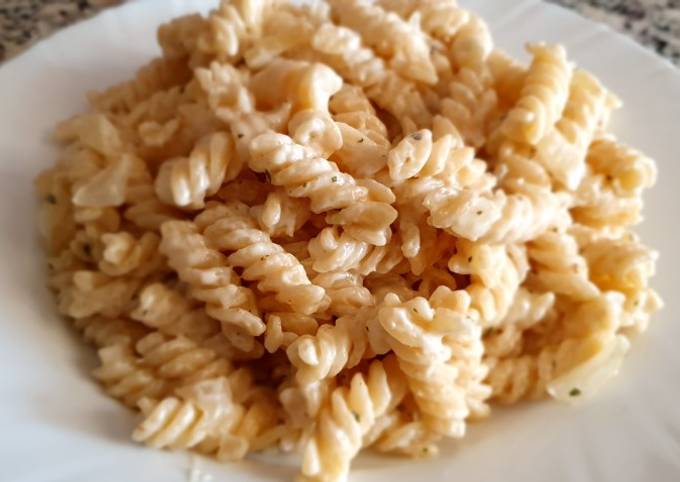
I want to click on table, so click(x=639, y=18).